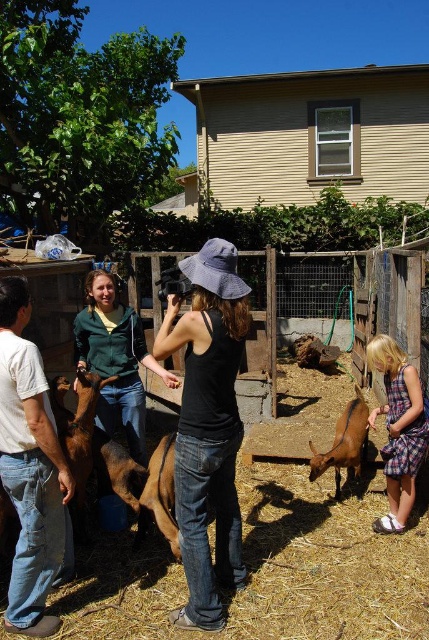
You are standing in the farm scene and notice the white cotton shirt at left and the brown furry goat at lower center. Which object is positioned higher from the ground?

The white cotton shirt at left is located above the brown furry goat at lower center, so it is higher from the ground.

You are a photographer standing in the fenced area with goats. You notice a white cotton shirt at left and a brown furry goat at lower center in your viewfinder. Which object is nearer to you?

The white cotton shirt at left is closer to the viewer than the brown furry goat at lower center, so the white cotton shirt at left is nearer to you.

You are a photographer standing near the fence at the farm. You want to capture a photo that includes both the brown fuzzy goat at left and the brown furry dog at center. Is there enough space between them to fit both in the frame?

The brown fuzzy goat at left and the brown furry dog at center are 12.63 inches apart. Since the distance between them is 12.63 inches, it is possible to fit both in the frame depending on the camera lens and zoom settings, but they will be relatively close together in the photo.